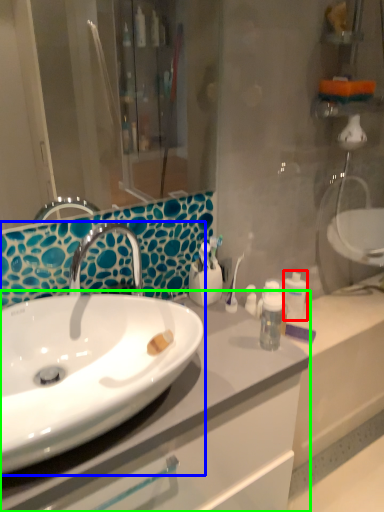
Question: Which object is the closest to the mouthwash (highlighted by a red box)? Choose among these: sink (highlighted by a blue box) or bathroom cabinet (highlighted by a green box).

Choices:
 (A) sink
 (B) bathroom cabinet

Answer: (B)